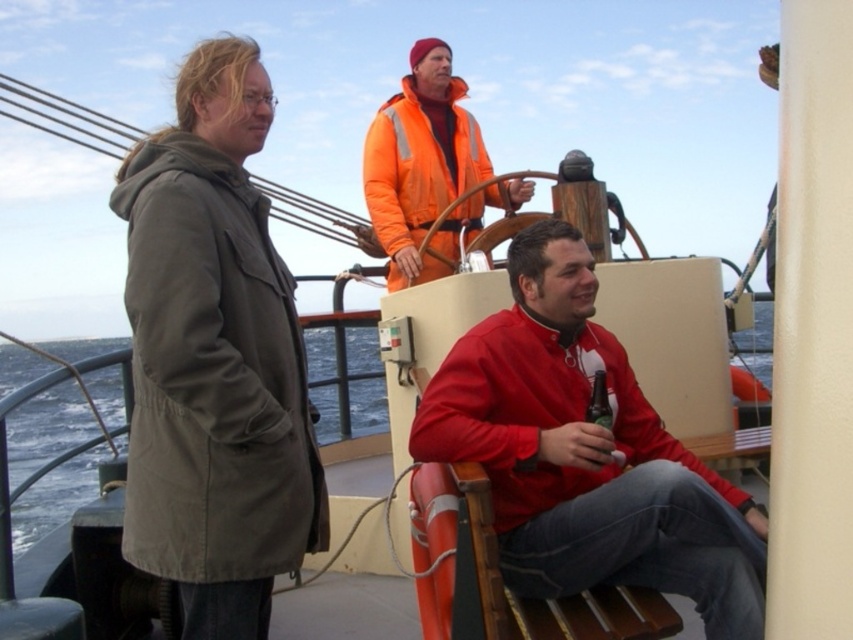
You are a photographer on the boat and want to take a photo that includes both the olive green canvas jacket at left and the green matte bottle at lower center. Which object will appear larger in the photo?

The olive green canvas jacket at left will appear larger in the photo because it is closer to the viewer than the green matte bottle at lower center.

In the scene shown: You are on a boat and need to locate the lifebuoy. The olive green canvas jacket at left and the orange reflective jacket at upper center are in your view. Which jacket is closer to you?

The olive green canvas jacket at left is closer to you because it is in front of the orange reflective jacket at upper center.

You are a safety inspector checking the boat for emergency equipment. The regulations require that the lifebuoy must be placed within 2 meters of the orange reflective jacket at upper center. Is the lifebuoy within the required distance?

The orange reflective jacket at upper center is located at point (x=416, y=166). However, the lifebuoy is not mentioned in the provided scene description or object details, so its position cannot be determined. Therefore, the requirement cannot be confirmed based on the given information.